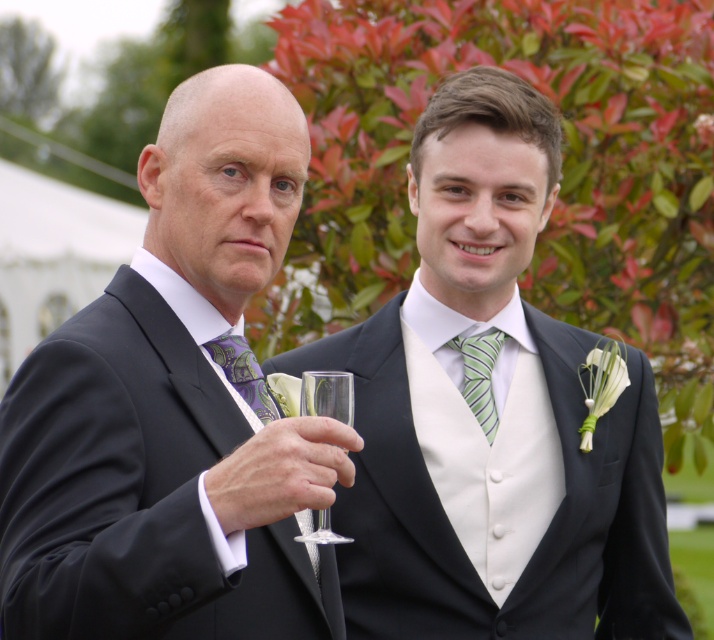
You are a photographer at a formal event and need to position two guests wearing matte black suits for a group photo. The guests are the matte black suit at left and the matte black suit at right. Given their suit widths, which guest should you place closer to the camera to avoid them appearing too small in the photo?

The matte black suit at left has a smaller width than the matte black suit at right. To ensure both appear proportionate, place the matte black suit at left closer to the camera since its narrower width would require less space, allowing it to be positioned nearer without appearing overly small compared to the wider matte black suit at right.